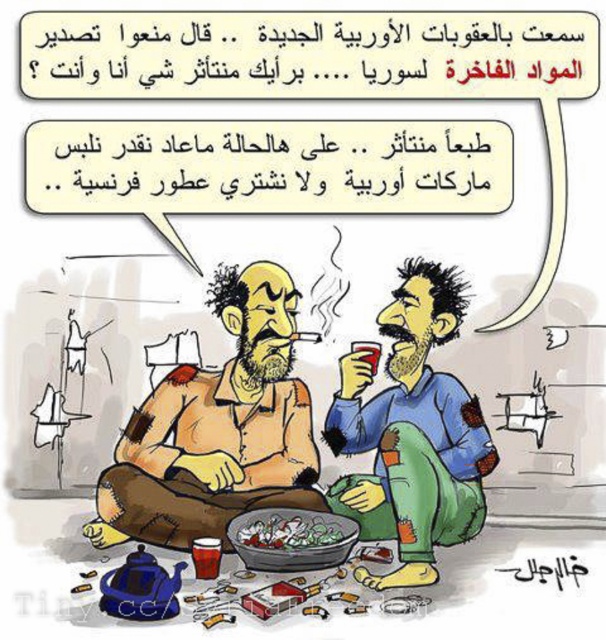
What is the color and material of the object located at coordinates point (218, 429)?

The object at point (218, 429) is a brown leather jacket.

You are a photographer taking a picture of the scene. You want to focus on the green leafy vegetables at center without the green patchwork pants at lower right blocking the view. Is this possible?

The green patchwork pants at lower right is closer to the viewer than the green leafy vegetables at center, so it will block the view of the green leafy vegetables at center. You need to move the green patchwork pants at lower right or adjust your angle to avoid obstruction.

You are a hiker who needs to reach the green leafy vegetables at center to grab some for a snack. You are currently standing in front of the brown leather jacket at center. Can you reach the vegetables without moving the jacket?

The brown leather jacket at center is further to the viewer than green leafy vegetables at center, meaning the jacket is closer to you. Therefore, you would need to move the jacket to access the vegetables behind it.